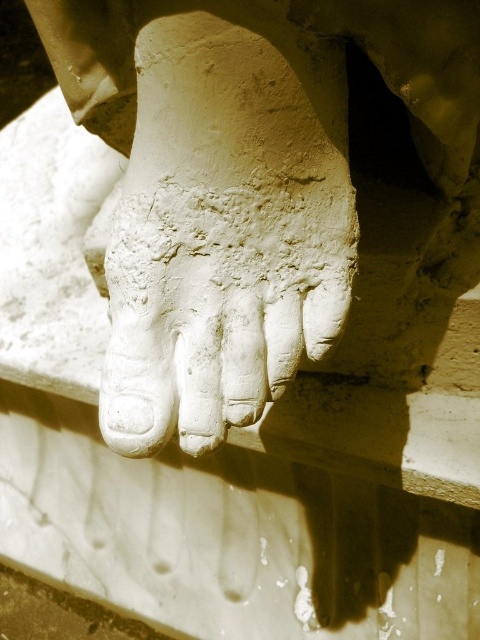
Which is more to the left, white stone foot at center or white stone hand at center?

white stone hand at center is more to the left.

Which is behind, point (129, 269) or point (219, 211)?

Point (129, 269)

The height and width of the screenshot is (640, 480). Find the location of `white stone foot at center`. white stone foot at center is located at coordinates (252, 186).